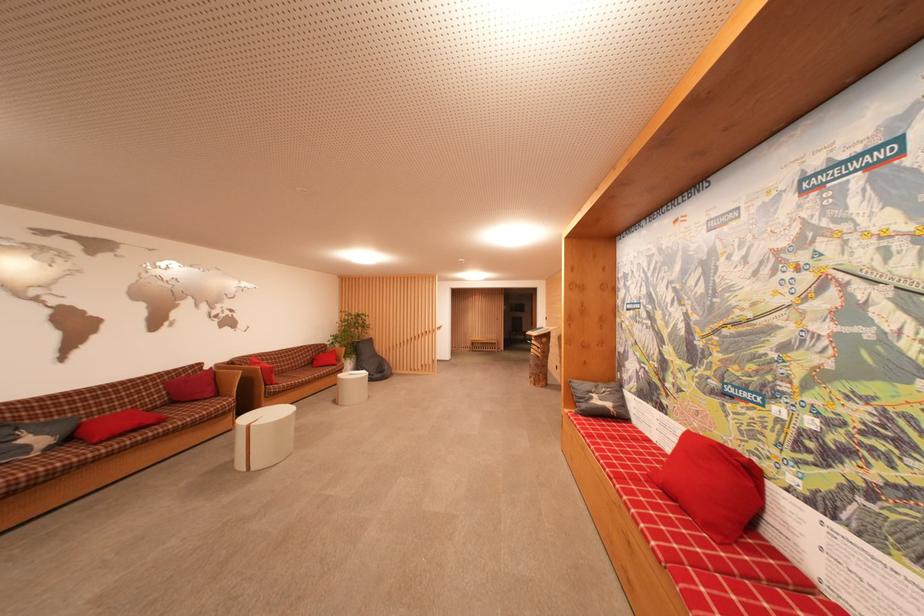
I want to click on grey patterned pillow, so click(x=599, y=399).